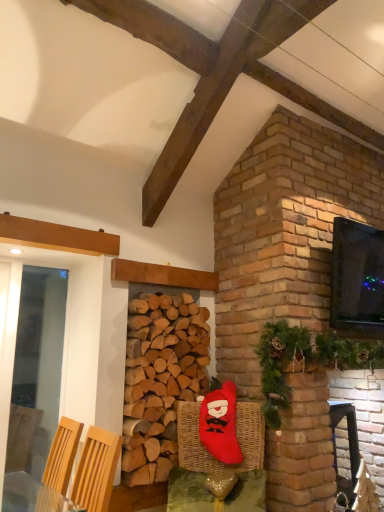
Where is `red plush santa at center`? This screenshot has height=512, width=384. red plush santa at center is located at coordinates (220, 424).

What is the approximate width of transparent glass door at left?

transparent glass door at left is 3.28 inches in width.

The height and width of the screenshot is (512, 384). What do you see at coordinates (37, 369) in the screenshot?
I see `transparent glass door at left` at bounding box center [37, 369].

What is the approximate height of green textured garland at upper right?

26.16 inches.

I want to click on red plush santa at center, so click(220, 424).

Is woven wicker armchair at lower right, the first armchair in the right-to-left sequence, positioned far away from light wood armchair at lower left, which appears as the 2th armchair when viewed from the back?

Indeed, woven wicker armchair at lower right, the first armchair in the right-to-left sequence, is not near light wood armchair at lower left, which appears as the 2th armchair when viewed from the back.

Can you tell me how much woven wicker armchair at lower right, which is counted as the first armchair, starting from the back, and light wood armchair at lower left, which appears as the 2th armchair when viewed from the back, differ in facing direction?

92.2 degrees.

From the image's perspective, is woven wicker armchair at lower right, the second armchair from the front, on top of light wood armchair at lower left, which appears as the 2th armchair when viewed from the back?

No, from the image's perspective, woven wicker armchair at lower right, the second armchair from the front, is not over light wood armchair at lower left, which appears as the 2th armchair when viewed from the back.

Is point (358, 473) closer to viewer compared to point (62, 487)?

No, it is not.

In the scene shown: Is black glossy tv at upper right oriented away from green textured garland at upper right?

black glossy tv at upper right does not have its back to green textured garland at upper right.

I want to click on christmas decoration in front of the black glossy tv at upper right, so click(x=305, y=360).

Does black glossy tv at upper right have a greater width compared to green textured garland at upper right?

No.

Considering the points (160, 429) and (264, 476), which point is behind, point (160, 429) or point (264, 476)?

The point (160, 429) is farther from the camera.

Which object is thinner, natural brown wood at center or woven wicker basket at lower center?

With smaller width is woven wicker basket at lower center.

How different are the orientations of natural brown wood at center and woven wicker basket at lower center in degrees?

They differ by 45.4 degrees in their facing directions.

Is natural brown wood at center turned away from woven wicker basket at lower center?

natural brown wood at center does not have its back to woven wicker basket at lower center.

Is natural brown wood at center shorter than red plush santa at center?

In fact, natural brown wood at center may be taller than red plush santa at center.

Between natural brown wood at center and red plush santa at center, which one is positioned behind?

Positioned behind is red plush santa at center.

Considering the sizes of objects natural brown wood at center and red plush santa at center in the image provided, who is wider, natural brown wood at center or red plush santa at center?

natural brown wood at center is wider.

From the image's perspective, which is below, natural brown wood at center or red plush santa at center?

red plush santa at center appears lower in the image.

Measure the distance from natural brown wood at center to light wood armchair at lower left, the 2th armchair positioned from the right.

natural brown wood at center and light wood armchair at lower left, the 2th armchair positioned from the right, are 18.94 inches apart.

From the image's perspective, starting from the natural brown wood at center, which armchair is the 1st one below? Please provide its 2D coordinates.

[(59, 465)]

What's the angular difference between natural brown wood at center and light wood armchair at lower left, which appears as the 2th armchair when viewed from the back,'s facing directions?

92.2 degrees.

From a real-world perspective, is natural brown wood at center positioned above or below light wood armchair at lower left, arranged as the first armchair when viewed from the front?

natural brown wood at center is above light wood armchair at lower left, arranged as the first armchair when viewed from the front.

Would you say light wood armchair at lower left, which appears as the 2th armchair when viewed from the back, is outside red plush santa at center?

light wood armchair at lower left, which appears as the 2th armchair when viewed from the back, lies outside red plush santa at center's area.

Which is less distant, (48,481) or (225,397)?

Point (48,481) is positioned closer to the camera compared to point (225,397).

Does light wood armchair at lower left, arranged as the 1th armchair when viewed from the left, have a smaller size compared to red plush santa at center?

Actually, light wood armchair at lower left, arranged as the 1th armchair when viewed from the left, might be larger than red plush santa at center.

Based on the photo, is light wood armchair at lower left, which appears as the 2th armchair when viewed from the back, facing away from red plush santa at center?

Absolutely, light wood armchair at lower left, which appears as the 2th armchair when viewed from the back, is directed away from red plush santa at center.

Is woven wicker basket at lower center facing towards black glossy tv at upper right?

No, woven wicker basket at lower center does not turn towards black glossy tv at upper right.

From a real-world perspective, is woven wicker basket at lower center below black glossy tv at upper right?

Yes, from a real-world perspective, woven wicker basket at lower center is under black glossy tv at upper right.

Considering the positions of point (229, 510) and point (352, 293), is point (229, 510) closer or farther from the camera than point (352, 293)?

Clearly, point (229, 510) is closer to the camera than point (352, 293).

Image resolution: width=384 pixels, height=512 pixels. Identify the location of armchair below the light wood armchair at lower left, the 2th armchair positioned from the right (from the image's perspective). (361, 493).

You are a GUI agent. You are given a task and a screenshot of the screen. Output one action in this format:
    pyautogui.click(x=<x>, y=<y>)
    Task: Click on the window screen located on the right of green textured garland at upper right
    
    Given the screenshot: What is the action you would take?
    pyautogui.click(x=357, y=277)

From the image, which object appears to be nearer to light wood armchair at lower left, arranged as the first armchair when viewed from the front, black glossy tv at upper right or green textured garland at upper right?

The object closer to light wood armchair at lower left, arranged as the first armchair when viewed from the front, is green textured garland at upper right.

Estimate the real-world distances between objects in this image. Which object is further from woven wicker basket at lower center, natural brown wood at center or woven wicker armchair at lower right, which is counted as the first armchair, starting from the back?

Among the two, woven wicker armchair at lower right, which is counted as the first armchair, starting from the back, is located further to woven wicker basket at lower center.

Which object lies further to the anchor point transparent glass door at left, natural brown wood at center or green textured garland at upper right?

The object further to transparent glass door at left is green textured garland at upper right.

Based on their spatial positions, is woven wicker basket at lower center or red plush santa at center closer to transparent glass door at left?

red plush santa at center is positioned closer to the anchor transparent glass door at left.

From the picture: Based on their spatial positions, is red plush santa at center or black glossy tv at upper right further from light wood armchair at lower left, arranged as the first armchair when viewed from the front?

Based on the image, black glossy tv at upper right appears to be further to light wood armchair at lower left, arranged as the first armchair when viewed from the front.

From the image, which object appears to be farther from transparent glass door at left, black glossy tv at upper right or red plush santa at center?

The object further to transparent glass door at left is black glossy tv at upper right.

From the image, which object appears to be farther from woven wicker armchair at lower right, the second armchair from the front, green textured garland at upper right or black glossy tv at upper right?

Among the two, black glossy tv at upper right is located further to woven wicker armchair at lower right, the second armchair from the front.

Based on their spatial positions, is black glossy tv at upper right or transparent glass door at left further from natural brown wood at center?

Based on the image, transparent glass door at left appears to be further to natural brown wood at center.

Image resolution: width=384 pixels, height=512 pixels. I want to click on table located between light wood armchair at lower left, arranged as the 1th armchair when viewed from the left, and red plush santa at center in the left-right direction, so click(188, 492).

Locate an element on the screen. Image resolution: width=384 pixels, height=512 pixels. santa claus between natural brown wood at center and woven wicker armchair at lower right, the first armchair in the right-to-left sequence, in the horizontal direction is located at coordinates (220, 424).

Where is `table between natural brown wood at center and green textured garland at upper right in the horizontal direction`? Image resolution: width=384 pixels, height=512 pixels. table between natural brown wood at center and green textured garland at upper right in the horizontal direction is located at coordinates (188, 492).

Where is `table situated between light wood armchair at lower left, the 2th armchair positioned from the right, and green textured garland at upper right from left to right`? This screenshot has height=512, width=384. table situated between light wood armchair at lower left, the 2th armchair positioned from the right, and green textured garland at upper right from left to right is located at coordinates [188, 492].